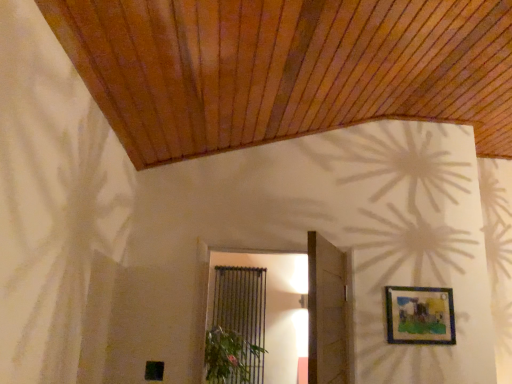
Question: Can you confirm if black metal screen door at center is positioned to the right of green leafy plant at lower center?

Choices:
 (A) no
 (B) yes

Answer: (A)

Question: Is black metal screen door at center looking in the opposite direction of green leafy plant at lower center?

Choices:
 (A) no
 (B) yes

Answer: (A)

Question: From the image's perspective, is black metal screen door at center below green leafy plant at lower center?

Choices:
 (A) no
 (B) yes

Answer: (B)

Question: Are black metal screen door at center and green leafy plant at lower center located far from each other?

Choices:
 (A) no
 (B) yes

Answer: (B)

Question: Does black metal screen door at center have a greater height compared to green leafy plant at lower center?

Choices:
 (A) no
 (B) yes

Answer: (B)

Question: In the image, is green leafy plant at lower center on the left side or the right side of black metal screen door at center?

Choices:
 (A) right
 (B) left

Answer: (A)

Question: From the image's perspective, is green leafy plant at lower center positioned above or below black metal screen door at center?

Choices:
 (A) below
 (B) above

Answer: (B)

Question: Is green leafy plant at lower center in front of or behind black metal screen door at center in the image?

Choices:
 (A) front
 (B) behind

Answer: (A)

Question: Is green leafy plant at lower center bigger or smaller than black metal screen door at center?

Choices:
 (A) small
 (B) big

Answer: (A)

Question: Is point 406,324 positioned closer to the camera than point 231,359?

Choices:
 (A) farther
 (B) closer

Answer: (B)

Question: From the image's perspective, relative to green leafy plant at lower center, is matte blue picture frame at upper right above or below?

Choices:
 (A) above
 (B) below

Answer: (A)

Question: Is matte blue picture frame at upper right situated inside green leafy plant at lower center or outside?

Choices:
 (A) inside
 (B) outside

Answer: (B)

Question: Relative to green leafy plant at lower center, is matte blue picture frame at upper right in front or behind?

Choices:
 (A) behind
 (B) front

Answer: (A)

Question: Considering their positions, is wooden door at center located in front of or behind green leafy plant at lower center?

Choices:
 (A) front
 (B) behind

Answer: (A)

Question: In terms of height, does wooden door at center look taller or shorter compared to green leafy plant at lower center?

Choices:
 (A) tall
 (B) short

Answer: (A)